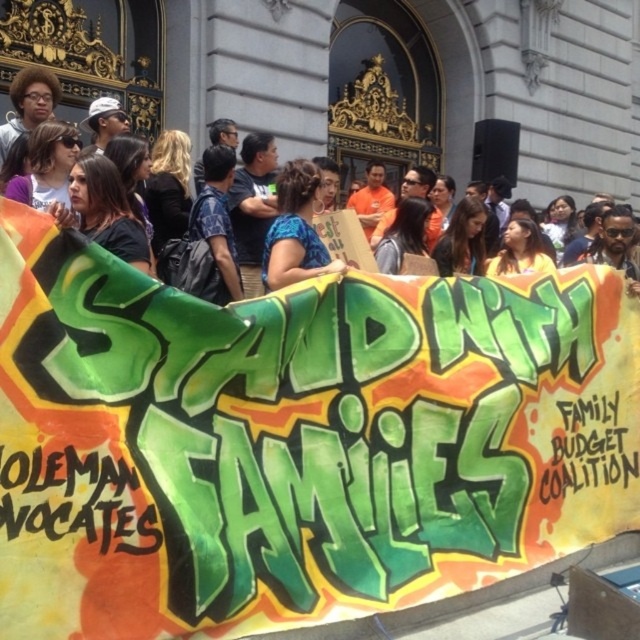
Question: Can you confirm if green painted banner at center is thinner than matte black banner at center?

Choices:
 (A) no
 (B) yes

Answer: (B)

Question: Among these objects, which one is nearest to the camera?

Choices:
 (A) matte black banner at center
 (B) blue fabric shirt at center

Answer: (A)

Question: Which object is positioned closest to the blue fabric shirt at center?

Choices:
 (A) matte black banner at center
 (B) green painted banner at center

Answer: (A)

Question: In this image, where is green painted banner at center located relative to matte black banner at center?

Choices:
 (A) right
 (B) left

Answer: (A)

Question: Which point is closer to the camera?

Choices:
 (A) blue fabric shirt at center
 (B) matte black banner at center
 (C) green painted banner at center

Answer: (C)

Question: Does green painted banner at center appear on the right side of matte black banner at center?

Choices:
 (A) no
 (B) yes

Answer: (B)